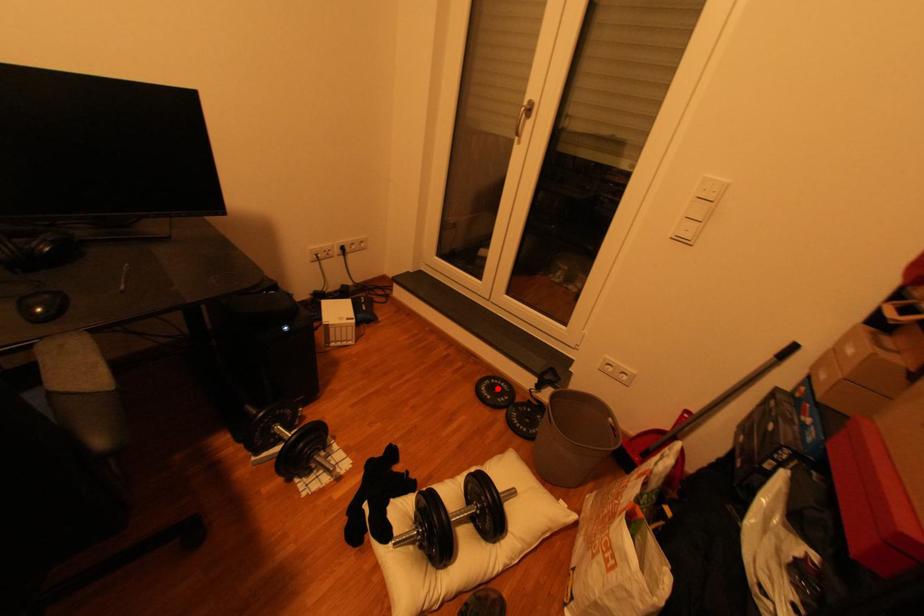
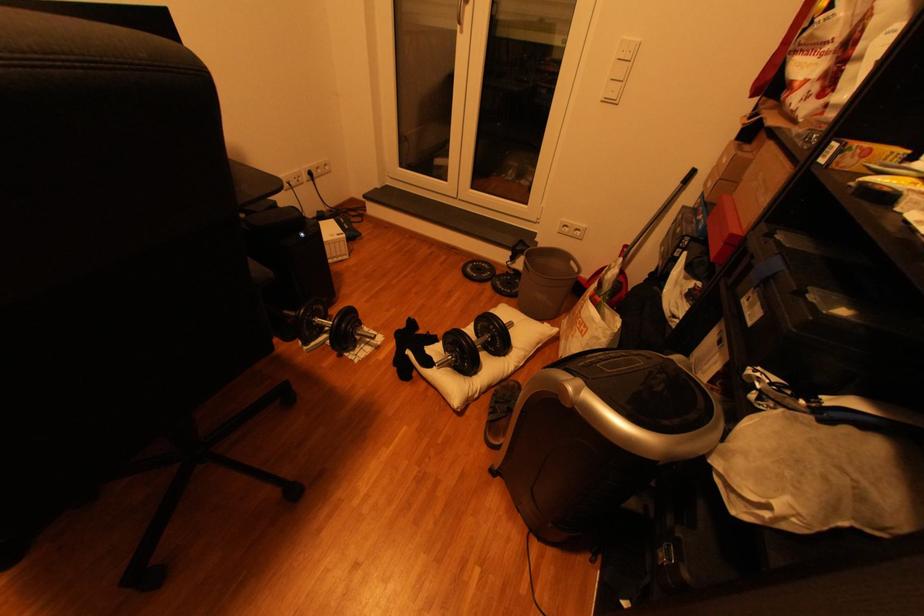
Question: A red point is marked in image1. In image2, is the corresponding 3D point closer to the camera or farther? Reply with the corresponding letter.

Choices:
 (A) The corresponding 3D point is closer.
 (B) The corresponding 3D point is farther.

Answer: (B)